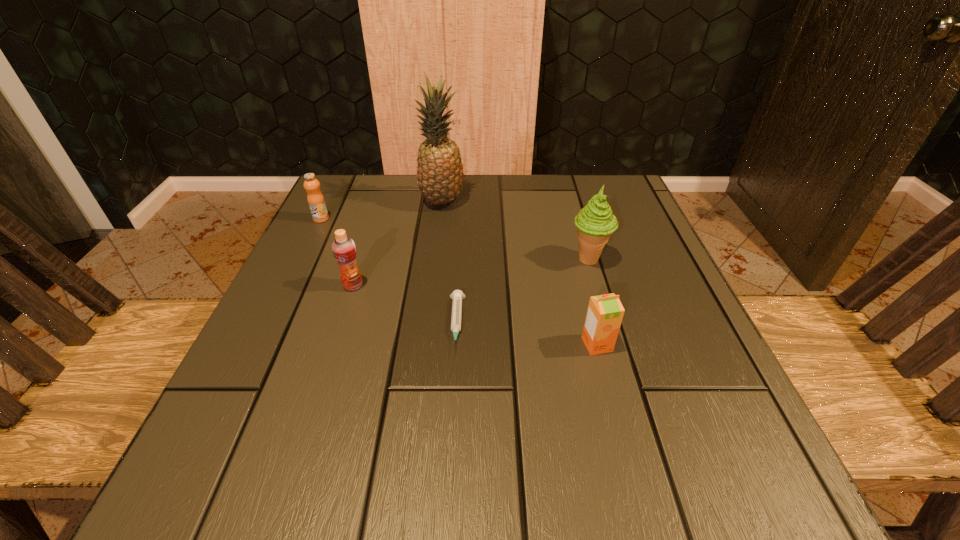
Where is `pineapple`? pineapple is located at coordinates (440, 174).

Where is `icecream`? This screenshot has width=960, height=540. icecream is located at coordinates (595, 223).

You are a GUI agent. You are given a task and a screenshot of the screen. Output one action in this format:
    pyautogui.click(x=<x>, y=<y>)
    Task: Click on the fifth shortest object
    Image resolution: width=960 pixels, height=540 pixels.
    Given the screenshot: What is the action you would take?
    pyautogui.click(x=595, y=223)

This screenshot has width=960, height=540. I want to click on the second orange juice from left to right, so click(x=344, y=250).

You are a GUI agent. You are given a task and a screenshot of the screen. Output one action in this format:
    pyautogui.click(x=<x>, y=<y>)
    Task: Click on the fourth farthest object
    
    Given the screenshot: What is the action you would take?
    pyautogui.click(x=344, y=250)

At what (x,y) coordinates should I click in order to perform the action: click on the farthest orange juice. Please return your answer as a coordinate pair (x, y). Looking at the image, I should click on (315, 199).

I want to click on the leftmost orange juice, so click(x=315, y=199).

Locate an element on the screen. Image resolution: width=960 pixels, height=540 pixels. the nearest orange juice is located at coordinates (605, 312).

Find the location of a particular element. This screenshot has height=540, width=960. syringe is located at coordinates (457, 295).

Locate an element on the screen. free space located on the front of the tallest object is located at coordinates (432, 279).